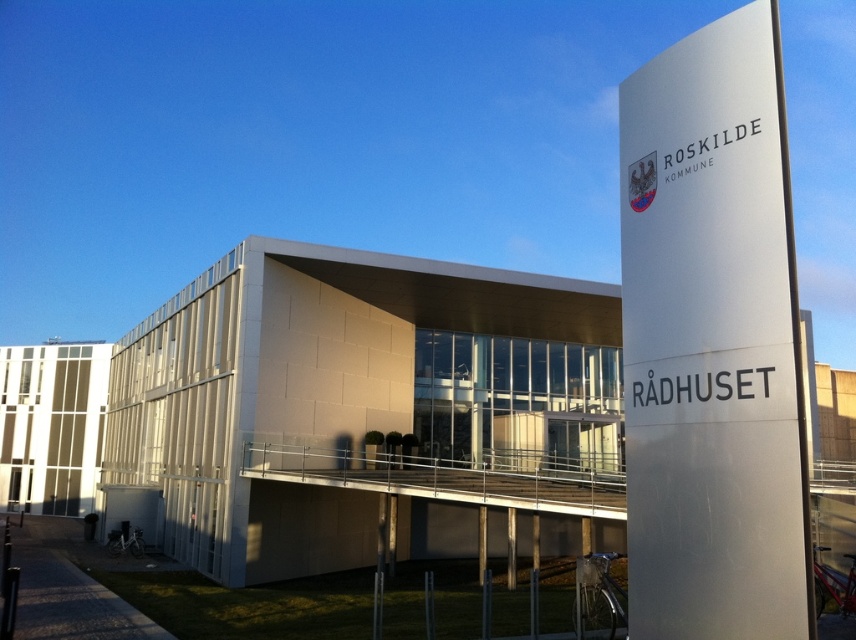
In the scene shown: You are a delivery driver who needs to deliver a package to the entrance of the white textured building at center. You see the satin silver sign at right in your path. Will the sign block your way to the building?

The satin silver sign at right is behind the white textured building at center, so it will not block your path to the building.

You are a city planner reviewing the architectural plans of the white textured building at center and the satin silver sign at right. Which structure is taller?

The white textured building at center is taller than the satin silver sign at right according to the architectural plans.